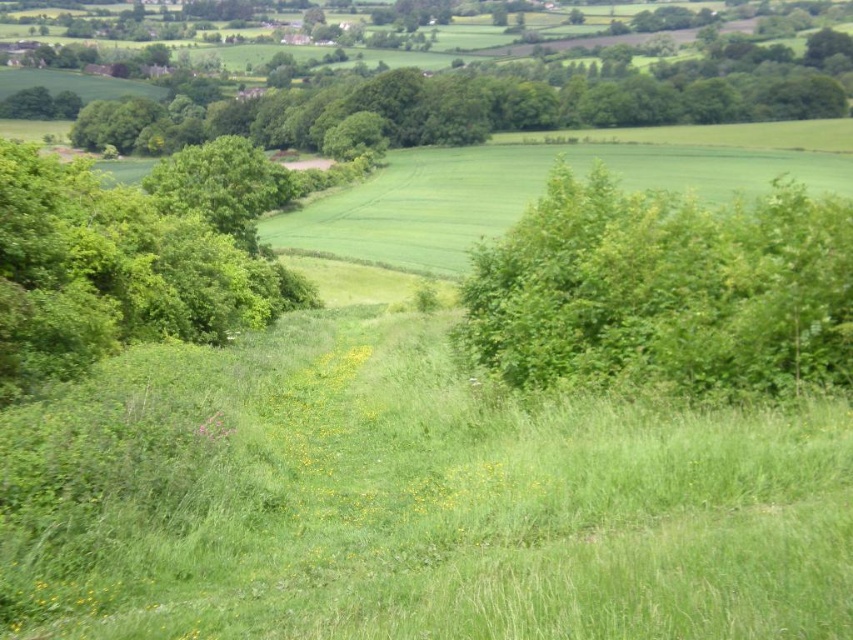
Question: Which object appears farthest from the camera in this image?

Choices:
 (A) green leafy bush at right
 (B) green leafy tree at left

Answer: (B)

Question: Among these points, which one is nearest to the camera?

Choices:
 (A) (844, 264)
 (B) (132, 305)

Answer: (A)

Question: Does green leafy bush at right appear over green leafy tree at left?

Choices:
 (A) yes
 (B) no

Answer: (B)

Question: In this image, where is green leafy bush at right located relative to green leafy tree at left?

Choices:
 (A) below
 (B) above

Answer: (A)

Question: Among these objects, which one is nearest to the camera?

Choices:
 (A) green leafy tree at left
 (B) green leafy bush at right

Answer: (B)

Question: Can you confirm if green leafy bush at right is thinner than green leafy tree at left?

Choices:
 (A) yes
 (B) no

Answer: (A)